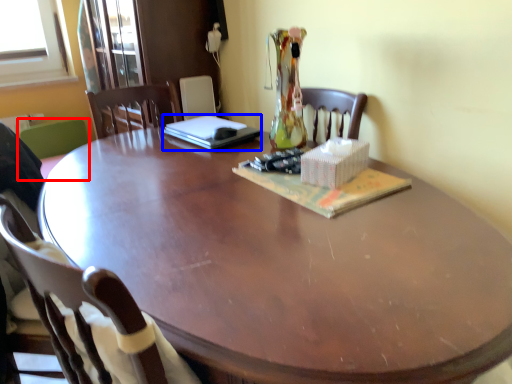
Question: Which object is closer to the camera taking this photo, chair (highlighted by a red box) or laptop (highlighted by a blue box)?

Choices:
 (A) chair
 (B) laptop

Answer: (B)